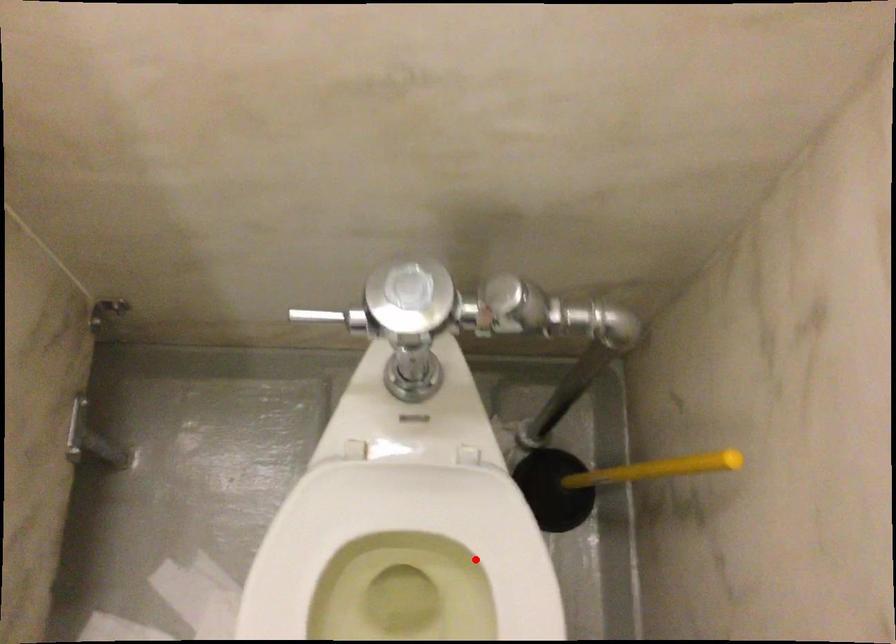
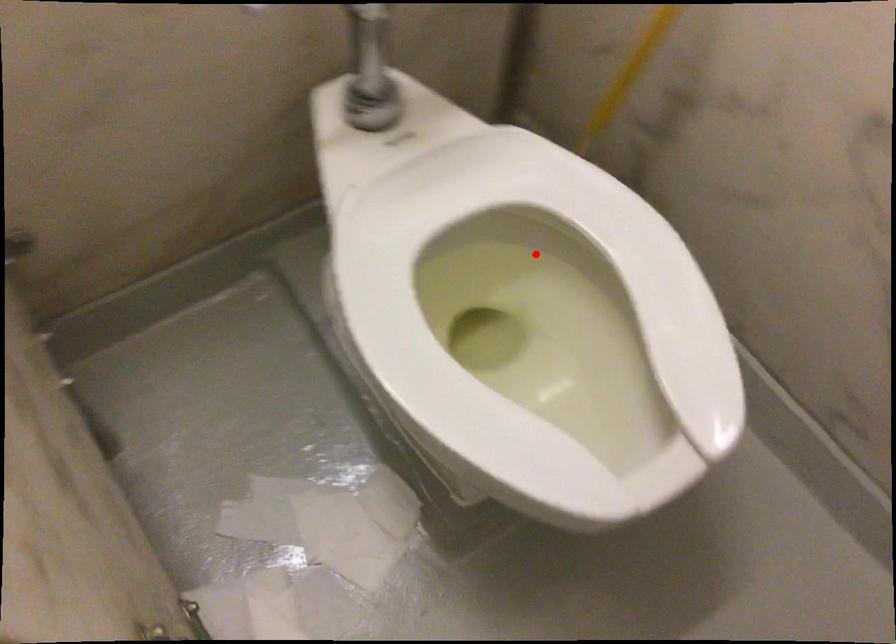
I am providing you with two images of the same scene from different viewpoints. A red point is marked on the first image and another point is marked on the second image. Are the points marked in image1 and image2 representing the same 3D position?

Yes